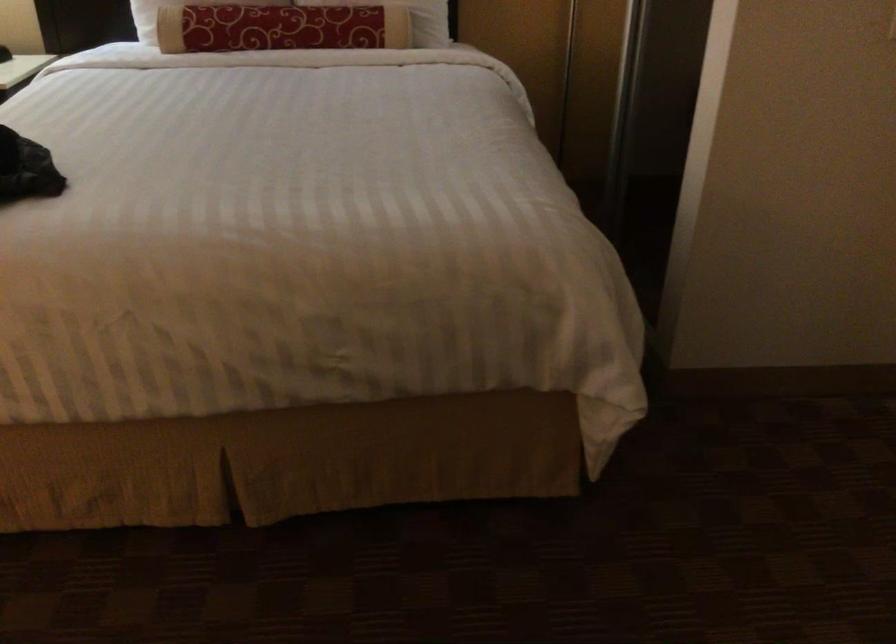
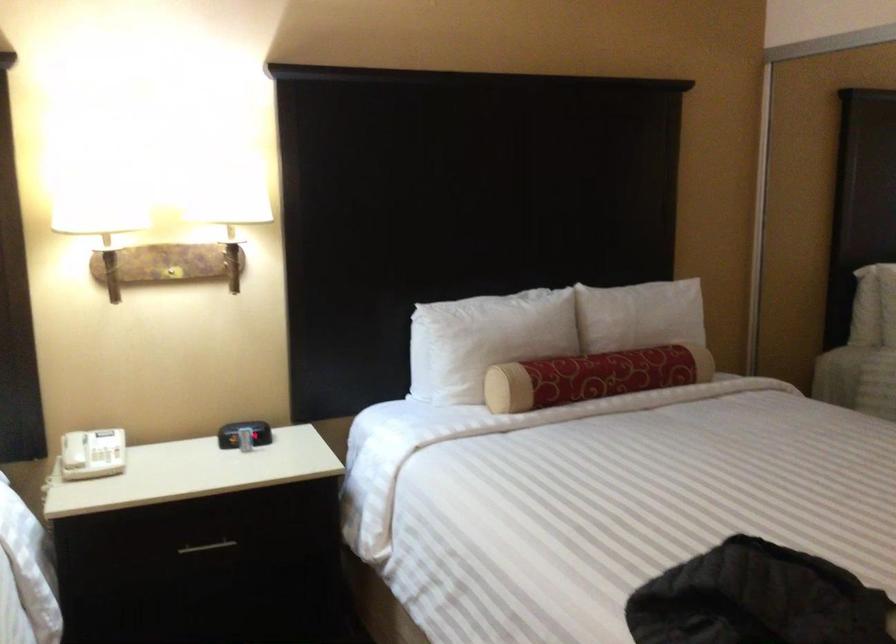
Question: What movement of the cameraman would produce the second image?

Choices:
 (A) Left
 (B) Right
 (C) Forward
 (D) Backward

Answer: (A)